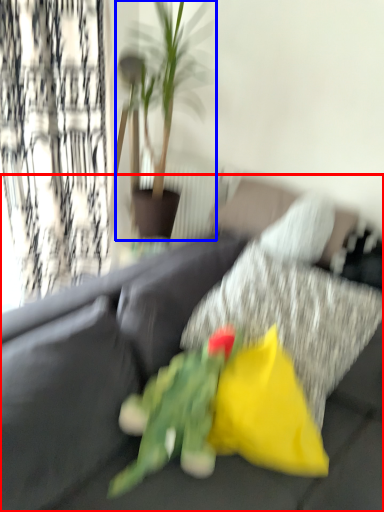
Question: Which of the following is the farthest to the observer, studio couch (highlighted by a red box) or houseplant (highlighted by a blue box)?

Choices:
 (A) studio couch
 (B) houseplant

Answer: (B)